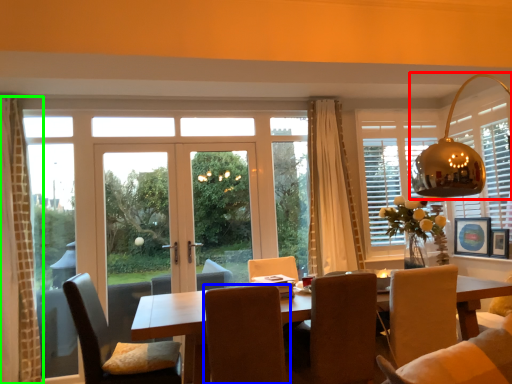
Question: Which is farther away from light fixture (highlighted by a red box)? chair (highlighted by a blue box) or curtain (highlighted by a green box)?

Choices:
 (A) chair
 (B) curtain

Answer: (B)